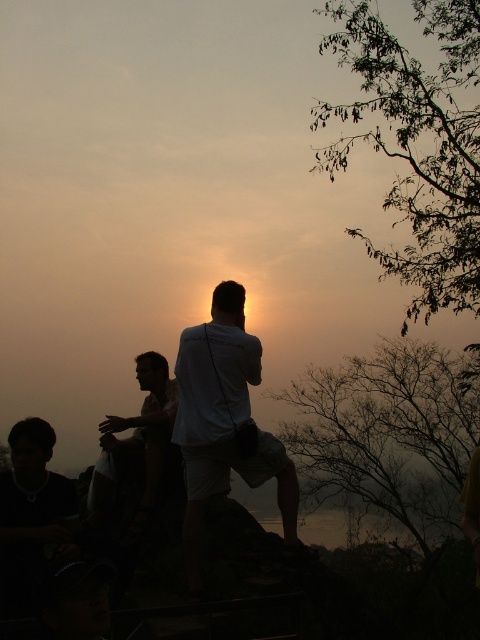
Question: Does white matte shirt at center have a larger size compared to light brown fabric shirt at center?

Choices:
 (A) yes
 (B) no

Answer: (B)

Question: Is white matte shirt at center thinner than light brown fabric shirt at center?

Choices:
 (A) yes
 (B) no

Answer: (B)

Question: Among these objects, which one is farthest from the camera?

Choices:
 (A) white matte shirt at center
 (B) light brown fabric shirt at center

Answer: (B)

Question: Does white matte shirt at center appear on the right side of light brown fabric shirt at center?

Choices:
 (A) no
 (B) yes

Answer: (B)

Question: Among these points, which one is farthest from the camera?

Choices:
 (A) (220, 301)
 (B) (144, 358)

Answer: (B)

Question: Which point appears farthest from the camera in this image?

Choices:
 (A) (244, 371)
 (B) (96, 465)

Answer: (B)